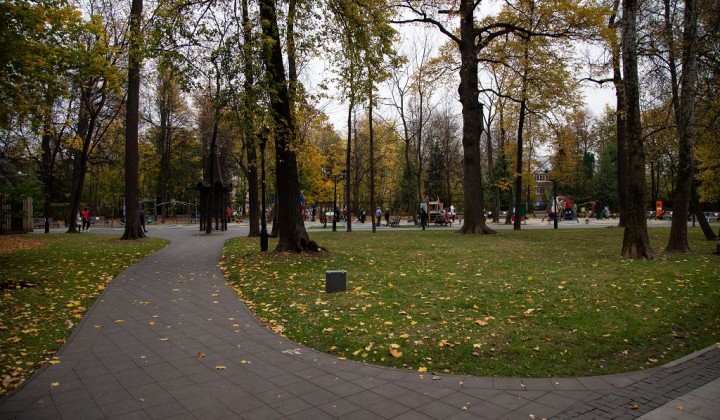
At what (x,y) coordinates should I click in order to perform the action: click on statue. Please return your answer as a coordinate pair (x, y). This screenshot has width=720, height=420. Looking at the image, I should click on (214, 176).